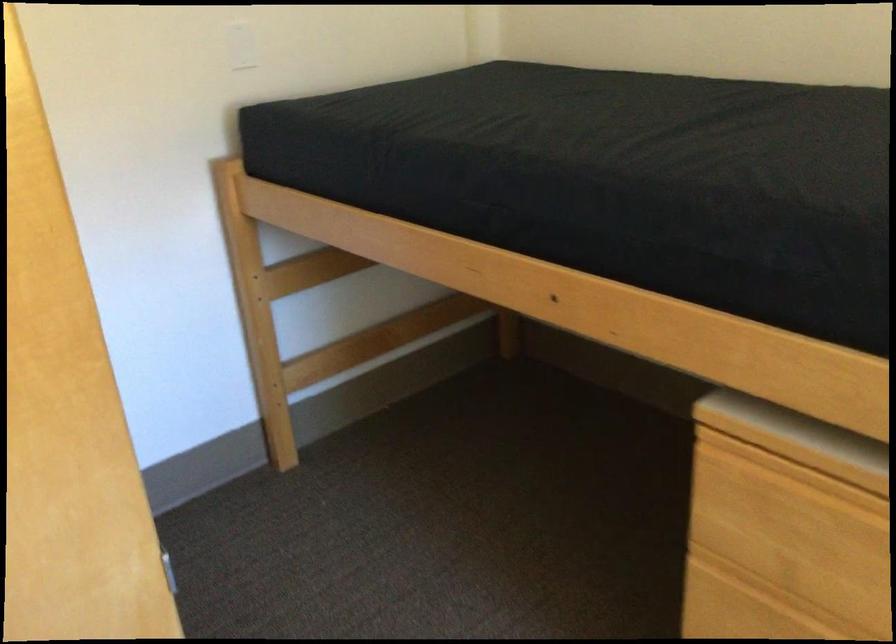
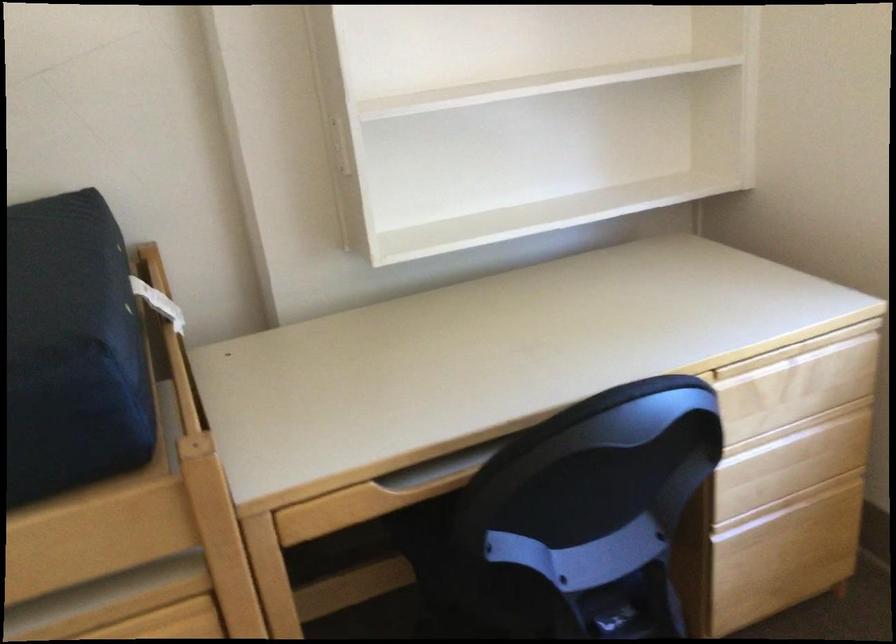
Question: The camera is either moving clockwise (left) or counter-clockwise (right) around the object. The first image is from the beginning of the video and the second image is from the end. Is the camera moving left or right when shooting the video?

Choices:
 (A) Left
 (B) Right

Answer: (A)